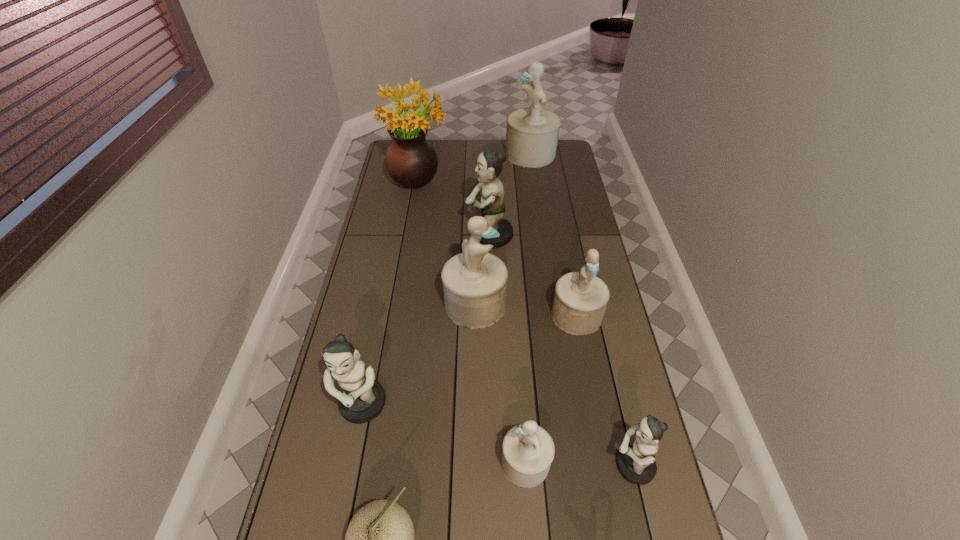
Locate an element on the screen. The image size is (960, 540). the nearest green figurine is located at coordinates (636, 463).

Identify the location of the rightmost green figurine. (x=636, y=463).

Locate an element on the screen. free space located 0.330m at the beak of the biggest white figurine is located at coordinates (440, 154).

Locate an element on the screen. This screenshot has height=540, width=960. vacant space located 0.110m at the beak of the biggest white figurine is located at coordinates (483, 154).

You are a GUI agent. You are given a task and a screenshot of the screen. Output one action in this format:
    pyautogui.click(x=<x>, y=<y>)
    Task: Click on the vacant position located 0.200m at the beak of the biggest white figurine
    
    Given the screenshot: What is the action you would take?
    pyautogui.click(x=466, y=154)

Find the location of a particular element. This screenshot has width=960, height=540. vacant space located on the front of the flower arrangement is located at coordinates (413, 213).

Where is `free region located 0.090m on the front-facing side of the third farthest object`? The image size is (960, 540). free region located 0.090m on the front-facing side of the third farthest object is located at coordinates (444, 236).

The width and height of the screenshot is (960, 540). I want to click on vacant area located 0.270m on the front-facing side of the third farthest object, so click(399, 236).

Locate an element on the screen. The height and width of the screenshot is (540, 960). free space located on the front-facing side of the third farthest object is located at coordinates (439, 236).

At what (x,y) coordinates should I click in order to perform the action: click on vacant space situated 0.200m at the beak of the second biggest white figurine. Please return your answer as a coordinate pair (x, y). This screenshot has height=540, width=960. Looking at the image, I should click on (564, 304).